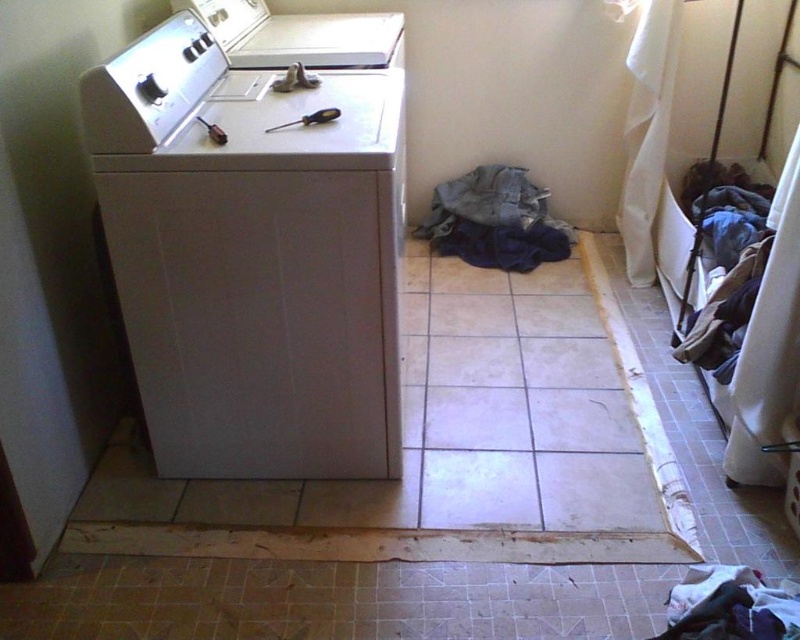
The image size is (800, 640). What do you see at coordinates (494, 220) in the screenshot? I see `faded denim jacket at lower center` at bounding box center [494, 220].

Is point (444, 240) farther from viewer compared to point (737, 620)?

Yes.

Is point (542, 241) in front of point (788, 634)?

No.

Where is `faded denim jacket at lower center`? The image size is (800, 640). faded denim jacket at lower center is located at coordinates (494, 220).

Measure the distance between white plastic washing machine at left and faded denim jacket at lower center.

white plastic washing machine at left is 3.86 feet away from faded denim jacket at lower center.

Does white plastic washing machine at left appear on the right side of faded denim jacket at lower center?

No, white plastic washing machine at left is not to the right of faded denim jacket at lower center.

Does point (334, 164) lie behind point (516, 195)?

That is False.

Identify the location of white plastic washing machine at left. Image resolution: width=800 pixels, height=640 pixels. (252, 257).

Consider the image. Which is more to the left, faded denim jacket at lower center or white glossy washing machine at center?

Positioned to the left is white glossy washing machine at center.

Who is lower down, faded denim jacket at lower center or white glossy washing machine at center?

faded denim jacket at lower center

Where is `faded denim jacket at lower center`? faded denim jacket at lower center is located at coordinates (494, 220).